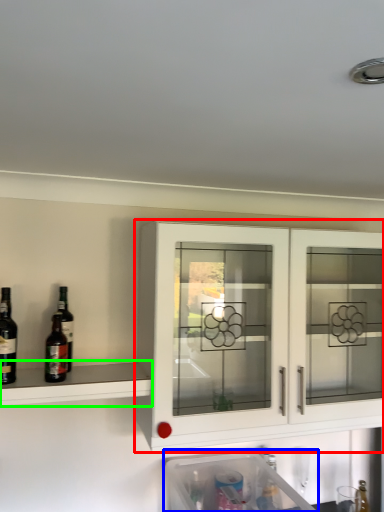
Question: Estimate the real-world distances between objects in this image. Which object is farther from cabinetry (highlighted by a red box), dish washer (highlighted by a blue box) or shelf (highlighted by a green box)?

Choices:
 (A) dish washer
 (B) shelf

Answer: (A)